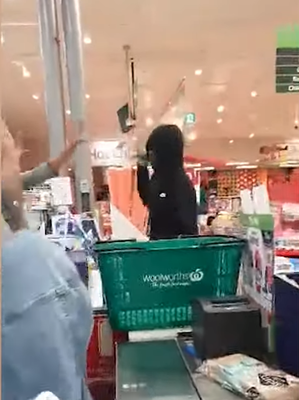
Where is `ceiling`? The height and width of the screenshot is (400, 299). ceiling is located at coordinates (168, 28).